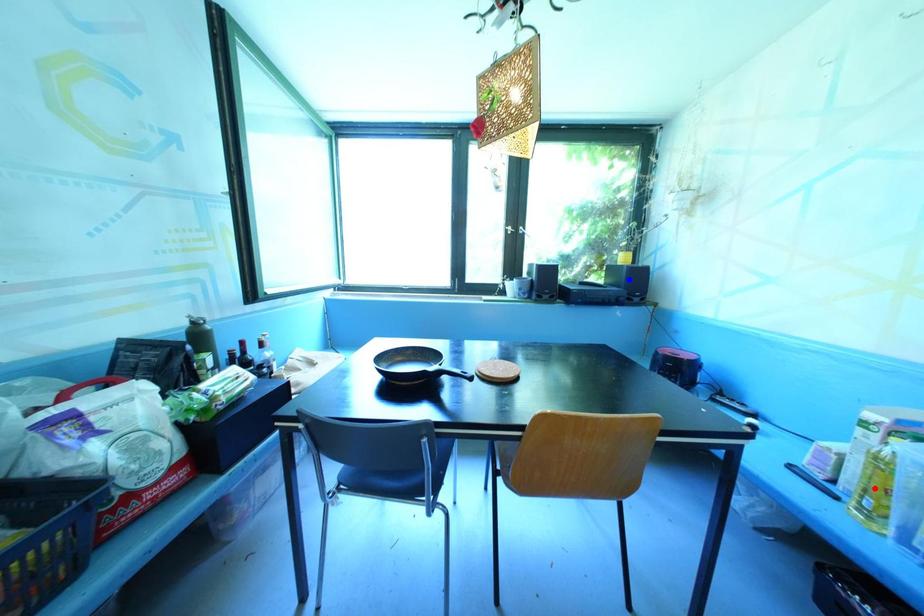
Question: Two points are marked on the image. Which point is closer to the camera?

Choices:
 (A) Blue point is closer.
 (B) Red point is closer.

Answer: (B)